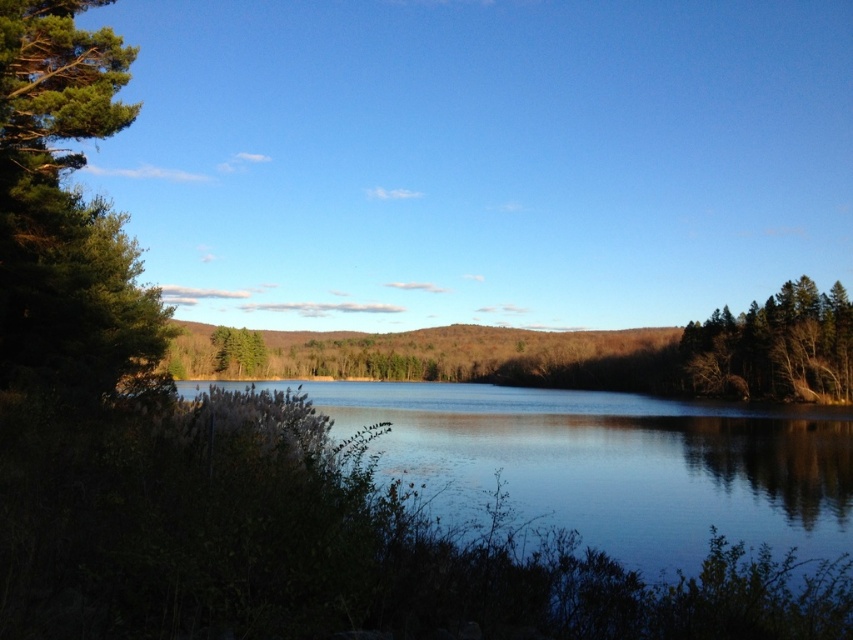
You are standing in the natural landscape scene and want to walk from the dense vegetation in the foreground to the far shore reflected in the lake. Which direction should you head towards, towards the clear water at center or the green matte tree at right?

You should head towards the clear water at center because it is located to the left of the green matte tree at right, which is closer to the far shore reflected in the lake.

You are standing on the lakeshore and see the clear water at center and the green matte tree at right. Which object is closer to the ground? Please explain your reasoning based on their positions.

The clear water at center is closer to the ground because it is positioned below the green matte tree at right.